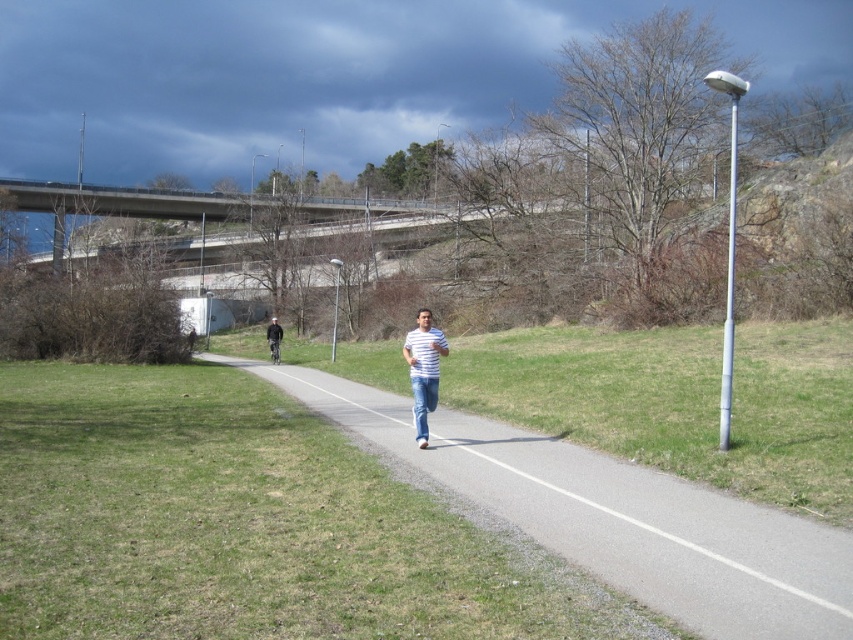
Question: Estimate the real-world distances between objects in this image. Which object is farther from the concrete bridge at upper center?

Choices:
 (A) striped fabric shirt at center
 (B) gray asphalt path at center

Answer: (A)

Question: Which object is positioned farthest from the dark blue jeans at center?

Choices:
 (A) striped fabric shirt at center
 (B) concrete bridge at upper center
 (C) gray asphalt path at center

Answer: (B)

Question: Among these points, which one is nearest to the camera?

Choices:
 (A) (270, 344)
 (B) (822, 541)
 (C) (97, 209)
 (D) (436, 353)

Answer: (B)

Question: Does striped fabric shirt at center have a smaller size compared to dark blue jeans at center?

Choices:
 (A) no
 (B) yes

Answer: (B)

Question: In this image, where is concrete bridge at upper center located relative to striped fabric shirt at center?

Choices:
 (A) right
 (B) left

Answer: (B)

Question: Is gray asphalt path at center positioned at the back of concrete bridge at upper center?

Choices:
 (A) yes
 (B) no

Answer: (B)